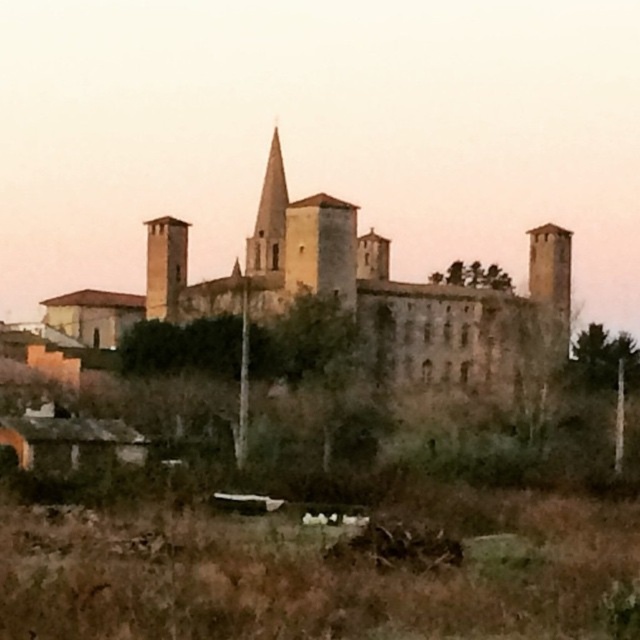
Question: Which point is farther to the camera?

Choices:
 (A) brown stone castle at center
 (B) stone tower at center-left

Answer: (B)

Question: Is the position of brown stone castle at center more distant than that of stone tower at center-left?

Choices:
 (A) yes
 (B) no

Answer: (B)

Question: Which point appears farthest from the camera in this image?

Choices:
 (A) (257, 260)
 (B) (397, 356)

Answer: (A)

Question: Is the position of stone tower at center-left less distant than that of smooth stone spire at center?

Choices:
 (A) yes
 (B) no

Answer: (B)

Question: Considering the relative positions of brown stone castle at center and smooth stone spire at center in the image provided, where is brown stone castle at center located with respect to smooth stone spire at center?

Choices:
 (A) right
 (B) left

Answer: (A)

Question: Which object is the closest to the stone tower at center-left?

Choices:
 (A) brown stone castle at center
 (B) smooth stone spire at center

Answer: (B)